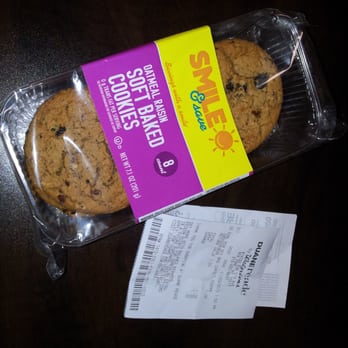
The width and height of the screenshot is (348, 348). I want to click on plastic tray, so click(16, 157).